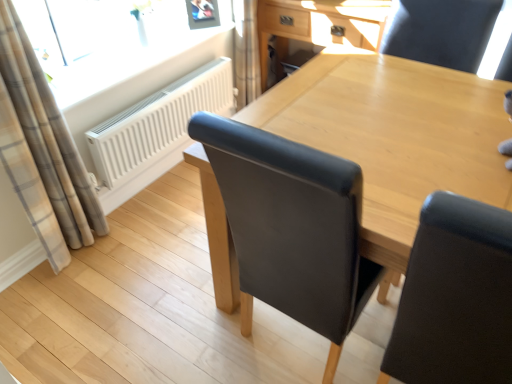
Question: Can you confirm if white matte radiator at upper left is shorter than black leather chair at upper right?

Choices:
 (A) yes
 (B) no

Answer: (A)

Question: Is white matte radiator at upper left closer to camera compared to black leather chair at upper right?

Choices:
 (A) yes
 (B) no

Answer: (B)

Question: Could you tell me if white matte radiator at upper left is facing black leather chair at upper right?

Choices:
 (A) no
 (B) yes

Answer: (B)

Question: Is white matte radiator at upper left at the right side of black leather chair at upper right?

Choices:
 (A) no
 (B) yes

Answer: (A)

Question: Does white matte radiator at upper left have a greater width compared to black leather chair at upper right?

Choices:
 (A) no
 (B) yes

Answer: (A)

Question: Is plaid fabric curtain at left taller or shorter than transparent glass window at upper left?

Choices:
 (A) tall
 (B) short

Answer: (A)

Question: Is plaid fabric curtain at left situated inside transparent glass window at upper left or outside?

Choices:
 (A) inside
 (B) outside

Answer: (B)

Question: Looking at their shapes, would you say plaid fabric curtain at left is wider or thinner than transparent glass window at upper left?

Choices:
 (A) wide
 (B) thin

Answer: (A)

Question: From the image's perspective, is plaid fabric curtain at left positioned above or below transparent glass window at upper left?

Choices:
 (A) below
 (B) above

Answer: (A)

Question: Is black leather chair at upper right situated inside metallic silver picture frame at upper center or outside?

Choices:
 (A) outside
 (B) inside

Answer: (A)

Question: From a real-world perspective, is black leather chair at upper right positioned above or below metallic silver picture frame at upper center?

Choices:
 (A) below
 (B) above

Answer: (A)

Question: Considering the positions of black leather chair at upper right and metallic silver picture frame at upper center in the image, is black leather chair at upper right taller or shorter than metallic silver picture frame at upper center?

Choices:
 (A) tall
 (B) short

Answer: (A)

Question: Looking at their shapes, would you say black leather chair at upper right is wider or thinner than metallic silver picture frame at upper center?

Choices:
 (A) wide
 (B) thin

Answer: (A)

Question: Considering the positions of point (31, 168) and point (226, 223), is point (31, 168) closer or farther from the camera than point (226, 223)?

Choices:
 (A) closer
 (B) farther

Answer: (B)

Question: Considering the relative positions of plaid fabric curtain at left and light brown wood table at center in the image provided, is plaid fabric curtain at left to the left or to the right of light brown wood table at center?

Choices:
 (A) left
 (B) right

Answer: (A)